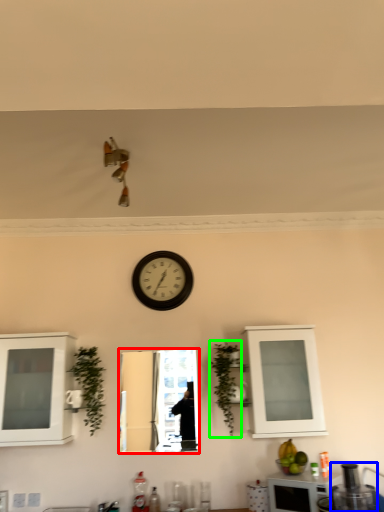
Question: Based on their relative distances, which object is farther from mirror (highlighted by a red box)? Choose from appliance (highlighted by a blue box) and plant (highlighted by a green box).

Choices:
 (A) appliance
 (B) plant

Answer: (A)